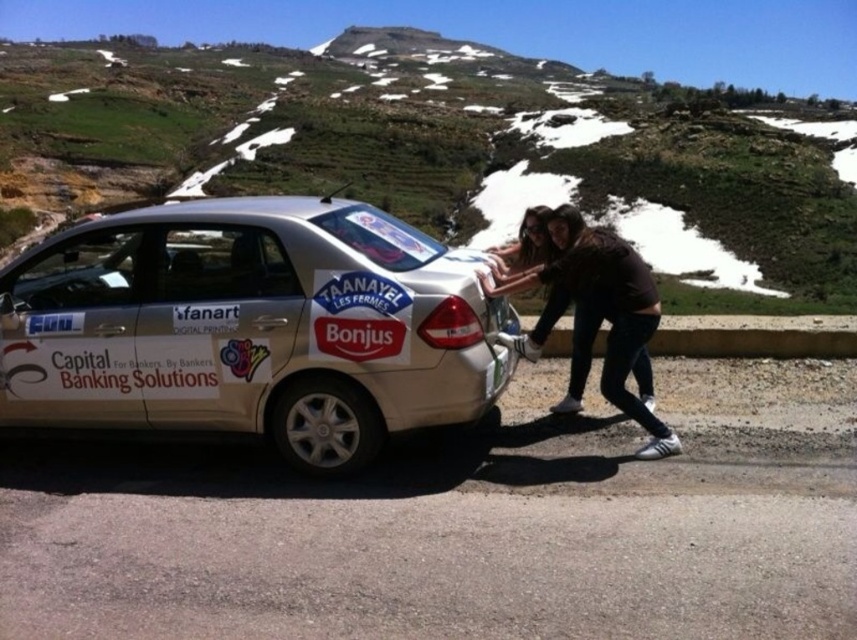
Between gold metallic car at center and dark brown leather jacket at center, which one has less height?

With less height is dark brown leather jacket at center.

Is gold metallic car at center thinner than dark brown leather jacket at center?

Incorrect, gold metallic car at center's width is not less than dark brown leather jacket at center's.

Locate an element on the screen. gold metallic car at center is located at coordinates (250, 326).